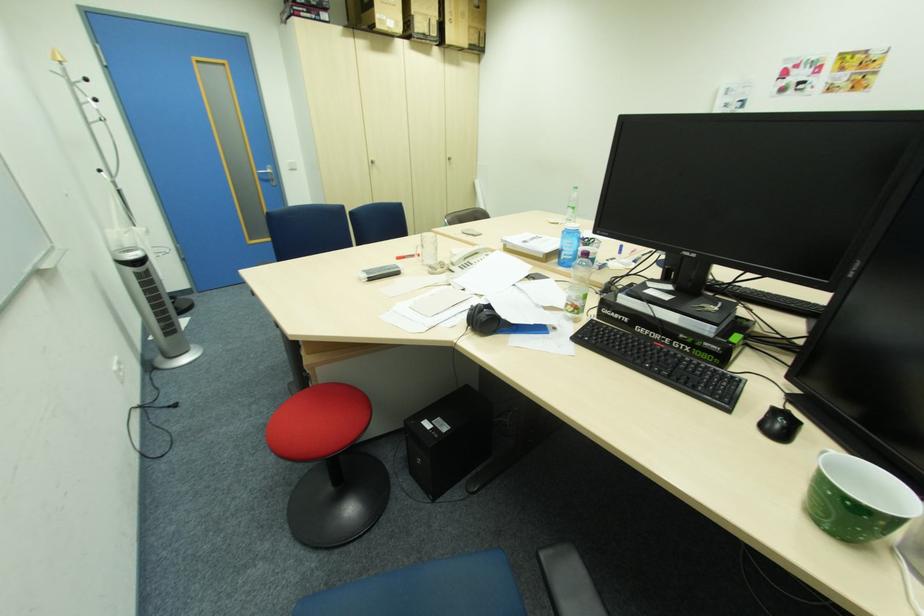
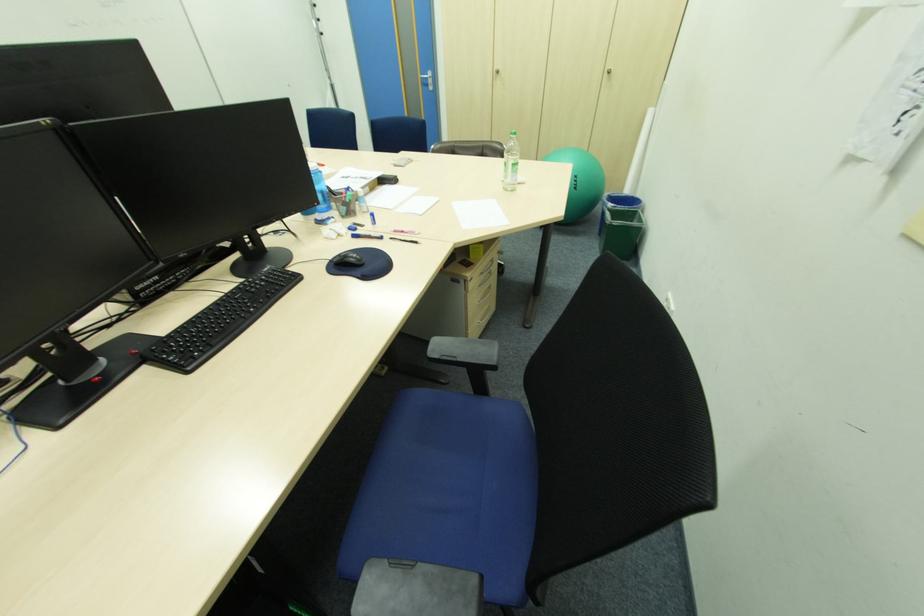
In the second image, find the point that corresponds to the point at 456,163 in the first image.

(615, 79)